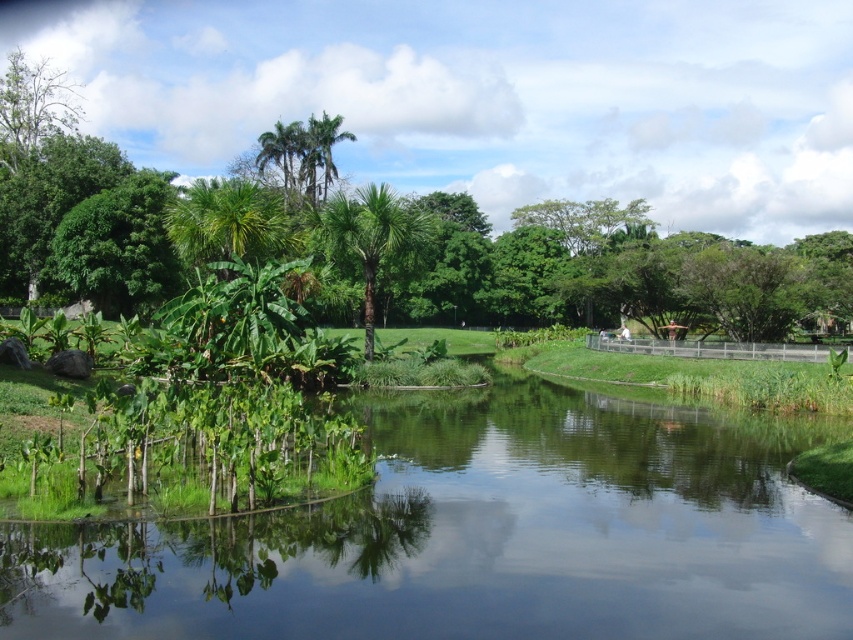
Can you confirm if green leafy palm tree at center is positioned to the left of green leafy tree at upper left?

In fact, green leafy palm tree at center is to the right of green leafy tree at upper left.

Is green leafy palm tree at center closer to the viewer compared to green leafy tree at upper left?

Yes.

Find the location of `green leafy palm tree at center`. green leafy palm tree at center is located at coordinates (370, 236).

You are a GUI agent. You are given a task and a screenshot of the screen. Output one action in this format:
    pyautogui.click(x=<x>, y=<y>)
    Task: Click on the green leafy palm tree at center
    This screenshot has width=853, height=640.
    Given the screenshot: What is the action you would take?
    pyautogui.click(x=370, y=236)

Who is lower down, green leafy river at center or green leafy tree at upper left?

green leafy river at center is lower down.

What do you see at coordinates (480, 536) in the screenshot? The width and height of the screenshot is (853, 640). I see `green leafy river at center` at bounding box center [480, 536].

Locate an element on the screen. The image size is (853, 640). green leafy river at center is located at coordinates click(480, 536).

Is green leafy river at center further to camera compared to green leafy palm tree at center?

No, it is in front of green leafy palm tree at center.

What do you see at coordinates (480, 536) in the screenshot? Image resolution: width=853 pixels, height=640 pixels. I see `green leafy river at center` at bounding box center [480, 536].

Where is `green leafy river at center`? This screenshot has width=853, height=640. green leafy river at center is located at coordinates (480, 536).